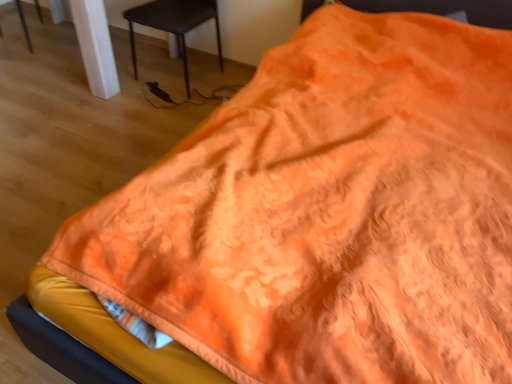
Describe the element at coordinates (24, 24) in the screenshot. I see `matte white chair at upper left, which is counted as the 2th chair, starting from the right` at that location.

The height and width of the screenshot is (384, 512). What are the coordinates of `matte white chair at upper left, the 1th chair viewed from the left` in the screenshot? It's located at (24, 24).

Find the location of a particular element. The image size is (512, 384). black plastic chair at lower left, the 2th chair viewed from the left is located at coordinates (174, 24).

What do you see at coordinates (174, 24) in the screenshot?
I see `black plastic chair at lower left, the 1th chair positioned from the right` at bounding box center [174, 24].

Where is `matte white chair at upper left, which is counted as the 2th chair, starting from the right`? matte white chair at upper left, which is counted as the 2th chair, starting from the right is located at coordinates (24, 24).

Does matte white chair at upper left, which is counted as the 2th chair, starting from the right, appear on the right side of black plastic chair at lower left, the 1th chair positioned from the right?

Incorrect, matte white chair at upper left, which is counted as the 2th chair, starting from the right, is not on the right side of black plastic chair at lower left, the 1th chair positioned from the right.

Does matte white chair at upper left, the 1th chair viewed from the left, lie in front of black plastic chair at lower left, the 1th chair positioned from the right?

No, matte white chair at upper left, the 1th chair viewed from the left, is behind black plastic chair at lower left, the 1th chair positioned from the right.

Based on the photo, which is less distant, (x=25, y=32) or (x=159, y=25)?

Point (x=25, y=32) appears to be farther away from the viewer than point (x=159, y=25).

From the image's perspective, which one is positioned lower, matte white chair at upper left, which is counted as the 2th chair, starting from the right, or black plastic chair at lower left, the 1th chair positioned from the right?

black plastic chair at lower left, the 1th chair positioned from the right, appears lower in the image.

From a real-world perspective, is matte white chair at upper left, which is counted as the 2th chair, starting from the right, on top of black plastic chair at lower left, the 1th chair positioned from the right?

No, from a real-world perspective, matte white chair at upper left, which is counted as the 2th chair, starting from the right, is not above black plastic chair at lower left, the 1th chair positioned from the right.

Is matte white chair at upper left, which is counted as the 2th chair, starting from the right, thinner than black plastic chair at lower left, the 2th chair viewed from the left?

Yes, matte white chair at upper left, which is counted as the 2th chair, starting from the right, is thinner than black plastic chair at lower left, the 2th chair viewed from the left.

Considering the sizes of matte white chair at upper left, the 1th chair viewed from the left, and black plastic chair at lower left, the 1th chair positioned from the right, in the image, is matte white chair at upper left, the 1th chair viewed from the left, taller or shorter than black plastic chair at lower left, the 1th chair positioned from the right,?

In the image, matte white chair at upper left, the 1th chair viewed from the left, appears to be shorter than black plastic chair at lower left, the 1th chair positioned from the right.

Between matte white chair at upper left, which is counted as the 2th chair, starting from the right, and black plastic chair at lower left, the 2th chair viewed from the left, which one has smaller size?

With smaller size is matte white chair at upper left, which is counted as the 2th chair, starting from the right.

Is black plastic chair at lower left, the 1th chair positioned from the right, located within matte white chair at upper left, the 1th chair viewed from the left?

No, black plastic chair at lower left, the 1th chair positioned from the right, is located outside of matte white chair at upper left, the 1th chair viewed from the left.

Is matte white chair at upper left, the 1th chair viewed from the left, positioned far away from black plastic chair at lower left, the 1th chair positioned from the right?

That's right, there is a large distance between matte white chair at upper left, the 1th chair viewed from the left, and black plastic chair at lower left, the 1th chair positioned from the right.

Could you tell me if matte white chair at upper left, which is counted as the 2th chair, starting from the right, is facing black plastic chair at lower left, the 1th chair positioned from the right?

Yes.

What's the angular difference between matte white chair at upper left, the 1th chair viewed from the left, and black plastic chair at lower left, the 1th chair positioned from the right,'s facing directions?

The facing directions of matte white chair at upper left, the 1th chair viewed from the left, and black plastic chair at lower left, the 1th chair positioned from the right, are 86.2 degrees apart.

Find the location of a particular element. Image resolution: width=512 pixels, height=384 pixels. chair on the left of black plastic chair at lower left, the 1th chair positioned from the right is located at coordinates (x=24, y=24).

Considering the relative positions of black plastic chair at lower left, the 2th chair viewed from the left, and matte white chair at upper left, which is counted as the 2th chair, starting from the right, in the image provided, is black plastic chair at lower left, the 2th chair viewed from the left, to the left or to the right of matte white chair at upper left, which is counted as the 2th chair, starting from the right,?

Clearly, black plastic chair at lower left, the 2th chair viewed from the left, is on the right of matte white chair at upper left, which is counted as the 2th chair, starting from the right, in the image.

Considering their positions, is black plastic chair at lower left, the 1th chair positioned from the right, located in front of or behind matte white chair at upper left, which is counted as the 2th chair, starting from the right?

Clearly, black plastic chair at lower left, the 1th chair positioned from the right, is in front of matte white chair at upper left, which is counted as the 2th chair, starting from the right.

Considering the points (161, 10) and (39, 6), which point is in front, point (161, 10) or point (39, 6)?

Point (161, 10)

From the image's perspective, is black plastic chair at lower left, the 1th chair positioned from the right, located beneath matte white chair at upper left, which is counted as the 2th chair, starting from the right?

Correct, black plastic chair at lower left, the 1th chair positioned from the right, appears lower than matte white chair at upper left, which is counted as the 2th chair, starting from the right, in the image.

From a real-world perspective, between black plastic chair at lower left, the 1th chair positioned from the right, and matte white chair at upper left, which is counted as the 2th chair, starting from the right, who is vertically lower?

matte white chair at upper left, which is counted as the 2th chair, starting from the right, from a real-world perspective.

Based on the photo, does black plastic chair at lower left, the 1th chair positioned from the right, have a lesser width compared to matte white chair at upper left, the 1th chair viewed from the left?

In fact, black plastic chair at lower left, the 1th chair positioned from the right, might be wider than matte white chair at upper left, the 1th chair viewed from the left.

From their relative heights in the image, would you say black plastic chair at lower left, the 1th chair positioned from the right, is taller or shorter than matte white chair at upper left, which is counted as the 2th chair, starting from the right?

Considering their sizes, black plastic chair at lower left, the 1th chair positioned from the right, has more height than matte white chair at upper left, which is counted as the 2th chair, starting from the right.

Considering the sizes of objects black plastic chair at lower left, the 2th chair viewed from the left, and matte white chair at upper left, which is counted as the 2th chair, starting from the right, in the image provided, who is smaller, black plastic chair at lower left, the 2th chair viewed from the left, or matte white chair at upper left, which is counted as the 2th chair, starting from the right,?

Smaller between the two is matte white chair at upper left, which is counted as the 2th chair, starting from the right.

Is matte white chair at upper left, the 1th chair viewed from the left, inside black plastic chair at lower left, the 2th chair viewed from the left?

That's incorrect, matte white chair at upper left, the 1th chair viewed from the left, is not inside black plastic chair at lower left, the 2th chair viewed from the left.

Would you consider black plastic chair at lower left, the 1th chair positioned from the right, to be distant from matte white chair at upper left, the 1th chair viewed from the left?

black plastic chair at lower left, the 1th chair positioned from the right, is far away from matte white chair at upper left, the 1th chair viewed from the left.

Does black plastic chair at lower left, the 2th chair viewed from the left, turn towards matte white chair at upper left, which is counted as the 2th chair, starting from the right?

No, black plastic chair at lower left, the 2th chair viewed from the left, is not aimed at matte white chair at upper left, which is counted as the 2th chair, starting from the right.

How different are the orientations of black plastic chair at lower left, the 1th chair positioned from the right, and matte white chair at upper left, which is counted as the 2th chair, starting from the right, in degrees?

The angular difference between black plastic chair at lower left, the 1th chair positioned from the right, and matte white chair at upper left, which is counted as the 2th chair, starting from the right, is 86.2 degrees.

How much distance is there between black plastic chair at lower left, the 2th chair viewed from the left, and matte white chair at upper left, which is counted as the 2th chair, starting from the right?

black plastic chair at lower left, the 2th chair viewed from the left, is 1.18 meters away from matte white chair at upper left, which is counted as the 2th chair, starting from the right.

Locate an element on the screen. The width and height of the screenshot is (512, 384). chair on the left of black plastic chair at lower left, the 1th chair positioned from the right is located at coordinates (24, 24).

This screenshot has width=512, height=384. Find the location of `chair in front of the matte white chair at upper left, which is counted as the 2th chair, starting from the right`. chair in front of the matte white chair at upper left, which is counted as the 2th chair, starting from the right is located at coordinates (174, 24).

Where is `chair on the left of the black plastic chair at lower left, the 2th chair viewed from the left`? Image resolution: width=512 pixels, height=384 pixels. chair on the left of the black plastic chair at lower left, the 2th chair viewed from the left is located at coordinates (24, 24).